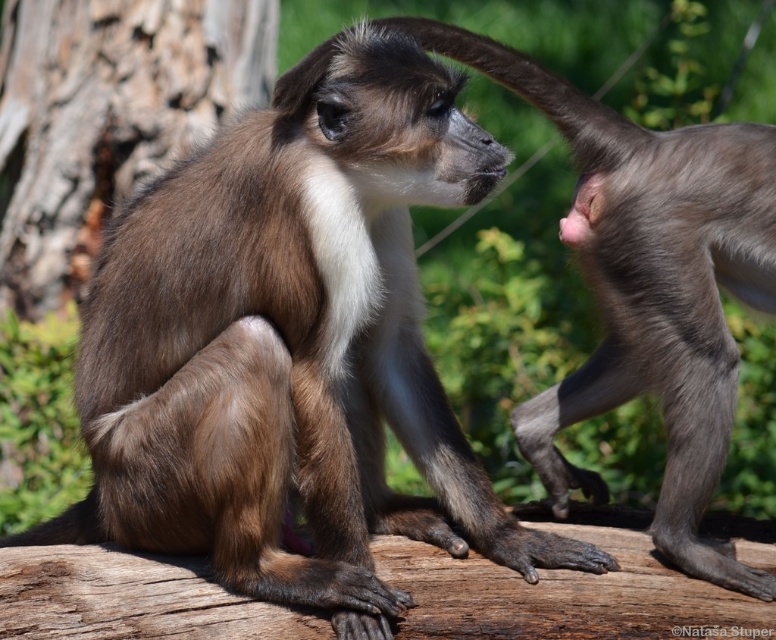
You are observing two points in the image of the monkeys. Which point is nearer to you, point [709,365] or point [267,84]?

Point [709,365] is closer to the camera than point [267,84].

You are a wildlife photographer trying to capture a photo of the brown fur monkey at upper right and the brown rough bark at left. Based on their sizes, which one should you zoom in on more to ensure both are clearly visible in the frame?

The brown fur monkey at upper right is taller than the brown rough bark at left, so you should zoom in more on the brown fur monkey at upper right to ensure both are clearly visible in the frame.